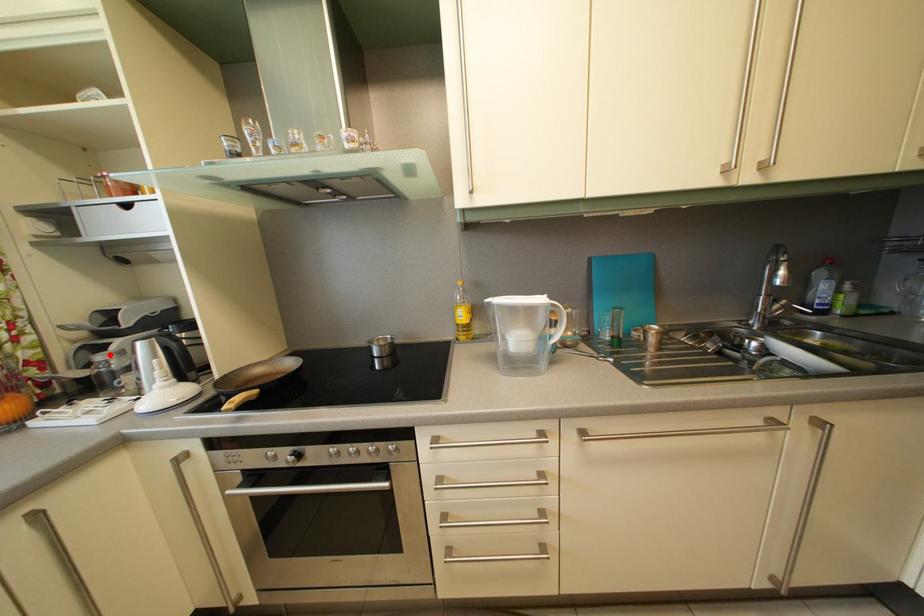
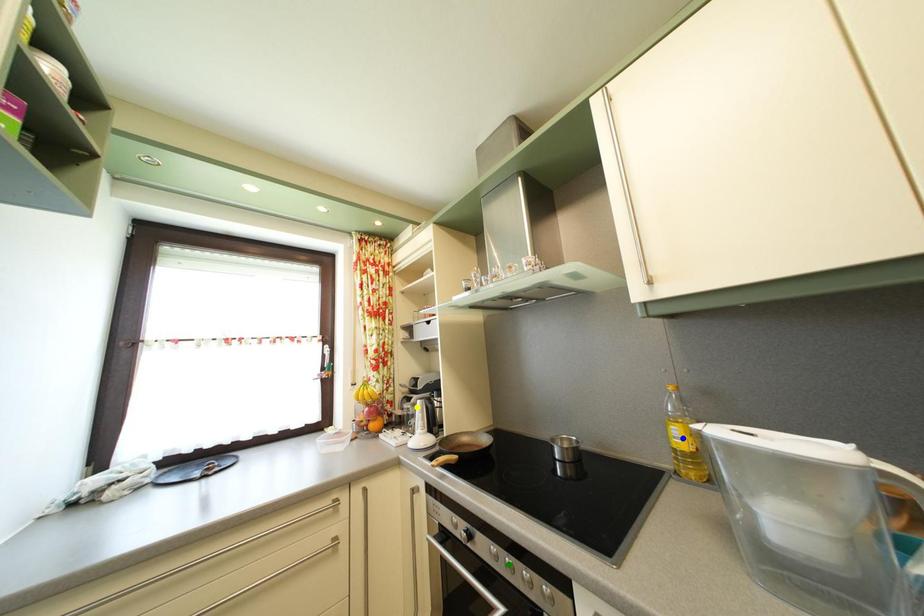
Question: I am providing you with two images of the same scene from different viewpoints. A red point is marked on the first image. You are given multiple points on the second image. Which mark in image 2 goes with the point in image 1?

Choices:
 (A) green point
 (B) yellow point
 (C) blue point

Answer: (B)